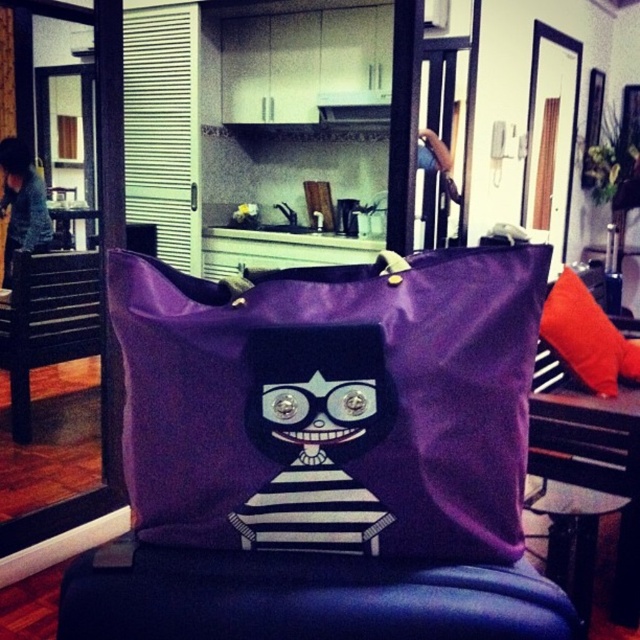
Question: Can you confirm if orange fabric pillow at right is smaller than blue denim jacket at left?

Choices:
 (A) yes
 (B) no

Answer: (B)

Question: Does purple fabric tote at center have a lesser width compared to orange fabric pillow at right?

Choices:
 (A) yes
 (B) no

Answer: (A)

Question: Which is farther from the orange fabric pillow at right?

Choices:
 (A) purple fabric tote at center
 (B) blue denim jacket at left
 (C) black wood swivel chair at left

Answer: (B)

Question: Can you confirm if black wood swivel chair at left is wider than orange fabric pillow at right?

Choices:
 (A) yes
 (B) no

Answer: (B)

Question: Which point is closer to the camera?

Choices:
 (A) purple fabric stool at center
 (B) blue denim jacket at left

Answer: (A)

Question: Based on their relative distances, which object is nearer to the purple fabric stool at center?

Choices:
 (A) purple fabric tote at center
 (B) orange fabric pillow at right
 (C) black wood swivel chair at left
 (D) blue denim jacket at left

Answer: (A)